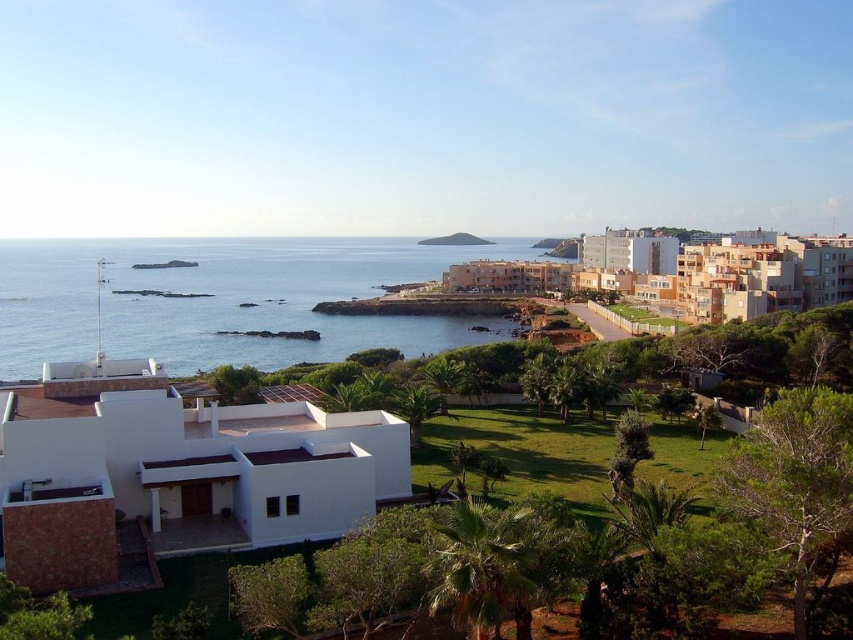
Is blue water at lower left closer to camera compared to green grassy hillside at center?

Yes.

Is blue water at lower left taller than green grassy hillside at center?

Correct, blue water at lower left is much taller as green grassy hillside at center.

The height and width of the screenshot is (640, 853). What do you see at coordinates (224, 300) in the screenshot?
I see `blue water at lower left` at bounding box center [224, 300].

In order to click on blue water at lower left in this screenshot , I will do `click(224, 300)`.